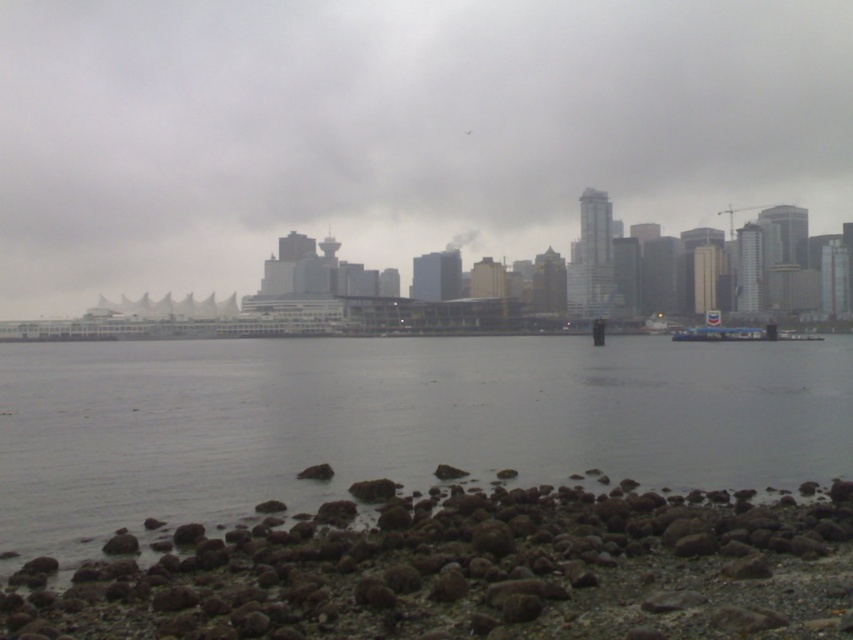
Question: Which object is closer to the camera taking this photo?

Choices:
 (A) rusty gravel rocks at lower left
 (B) gray water at center
 (C) matte gray sky at center

Answer: (A)

Question: Which is farther from the matte gray sky at center?

Choices:
 (A) rusty gravel rocks at lower left
 (B) gray water at center
 (C) white plastic boat at lower right

Answer: (A)

Question: Which of these objects is positioned farthest from the gray water at center?

Choices:
 (A) rusty gravel rocks at lower left
 (B) white plastic boat at lower right

Answer: (B)

Question: Can you confirm if matte gray sky at center is bigger than white plastic boat at lower right?

Choices:
 (A) yes
 (B) no

Answer: (A)

Question: Is gray water at center above white plastic boat at lower right?

Choices:
 (A) no
 (B) yes

Answer: (A)

Question: Is gray water at center smaller than rusty gravel rocks at lower left?

Choices:
 (A) yes
 (B) no

Answer: (B)